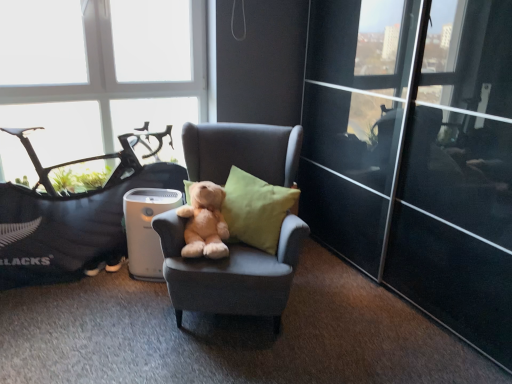
Question: From a real-world perspective, is transparent glass window at upper left physically above soft plush teddy bear at center?

Choices:
 (A) no
 (B) yes

Answer: (B)

Question: Would you say transparent glass window at upper left is outside soft plush teddy bear at center?

Choices:
 (A) yes
 (B) no

Answer: (A)

Question: Considering the relative sizes of transparent glass window at upper left and soft plush teddy bear at center in the image provided, is transparent glass window at upper left thinner than soft plush teddy bear at center?

Choices:
 (A) no
 (B) yes

Answer: (B)

Question: From the image's perspective, is transparent glass window at upper left below soft plush teddy bear at center?

Choices:
 (A) no
 (B) yes

Answer: (A)

Question: Is transparent glass window at upper left far from soft plush teddy bear at center?

Choices:
 (A) no
 (B) yes

Answer: (B)

Question: From a real-world perspective, is soft gray bean bag chair at left positioned above or below transparent glass door at right?

Choices:
 (A) above
 (B) below

Answer: (B)

Question: Considering their positions, is soft gray bean bag chair at left located in front of or behind transparent glass door at right?

Choices:
 (A) front
 (B) behind

Answer: (B)

Question: Looking at their shapes, would you say soft gray bean bag chair at left is wider or thinner than transparent glass door at right?

Choices:
 (A) thin
 (B) wide

Answer: (A)

Question: Considering the positions of soft gray bean bag chair at left and transparent glass door at right in the image, is soft gray bean bag chair at left bigger or smaller than transparent glass door at right?

Choices:
 (A) big
 (B) small

Answer: (B)

Question: Considering the relative positions of linen green pillow at center and transparent glass door at right in the image provided, is linen green pillow at center to the left or to the right of transparent glass door at right?

Choices:
 (A) left
 (B) right

Answer: (A)

Question: From a real-world perspective, relative to transparent glass door at right, is linen green pillow at center vertically above or below?

Choices:
 (A) below
 (B) above

Answer: (A)

Question: Is linen green pillow at center spatially inside transparent glass door at right, or outside of it?

Choices:
 (A) outside
 (B) inside

Answer: (A)

Question: Is linen green pillow at center bigger or smaller than transparent glass door at right?

Choices:
 (A) small
 (B) big

Answer: (A)

Question: In terms of height, does matte gray armchair at center look taller or shorter compared to transparent glass door at right?

Choices:
 (A) short
 (B) tall

Answer: (A)

Question: Is matte gray armchair at center bigger or smaller than transparent glass door at right?

Choices:
 (A) big
 (B) small

Answer: (B)